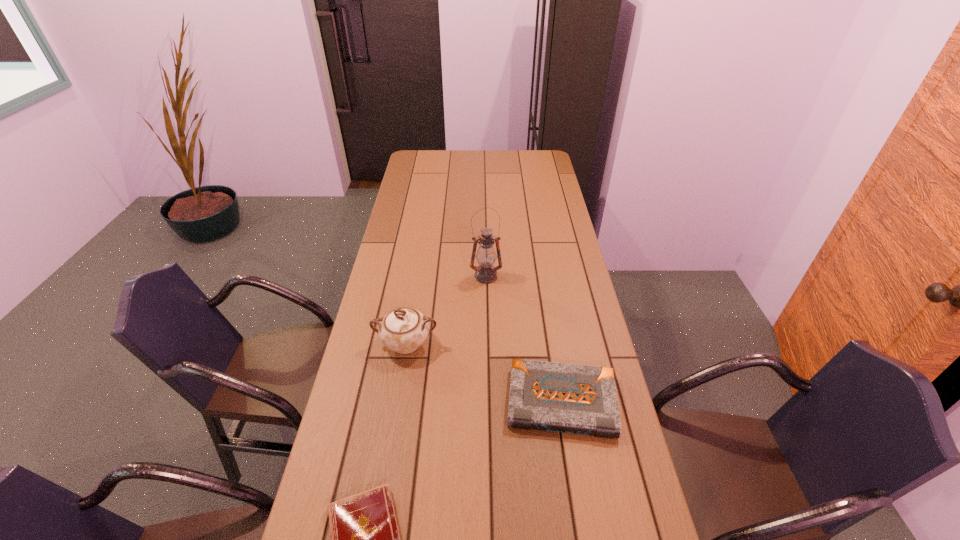
Where is `the tallest object`? This screenshot has width=960, height=540. the tallest object is located at coordinates (485, 273).

You are a GUI agent. You are given a task and a screenshot of the screen. Output one action in this format:
    pyautogui.click(x=<x>, y=<y>)
    Task: Click on the farthest object
    This screenshot has width=960, height=540.
    Given the screenshot: What is the action you would take?
    pyautogui.click(x=485, y=273)

I want to click on chinaware, so click(x=403, y=330).

This screenshot has height=540, width=960. Identify the location of the third nearest object. (403, 330).

Locate an element on the screen. This screenshot has height=540, width=960. the right notebook is located at coordinates (579, 399).

At what (x,y) coordinates should I click in order to perform the action: click on the third tallest object. Please return your answer as a coordinate pair (x, y). The width and height of the screenshot is (960, 540). Looking at the image, I should click on (579, 399).

The width and height of the screenshot is (960, 540). What are the coordinates of `blank area located on the front of the oil lamp` in the screenshot? It's located at (487, 308).

You are a GUI agent. You are given a task and a screenshot of the screen. Output one action in this format:
    pyautogui.click(x=<x>, y=<y>)
    Task: Click on the vacant region located 0.070m on the back of the second farthest object
    Image resolution: width=960 pixels, height=540 pixels.
    Given the screenshot: What is the action you would take?
    pyautogui.click(x=412, y=310)

Find the location of a particular element. The width and height of the screenshot is (960, 540). free space located 0.150m on the back of the second shortest object is located at coordinates (550, 329).

Image resolution: width=960 pixels, height=540 pixels. I want to click on object that is positioned at the left edge, so click(403, 330).